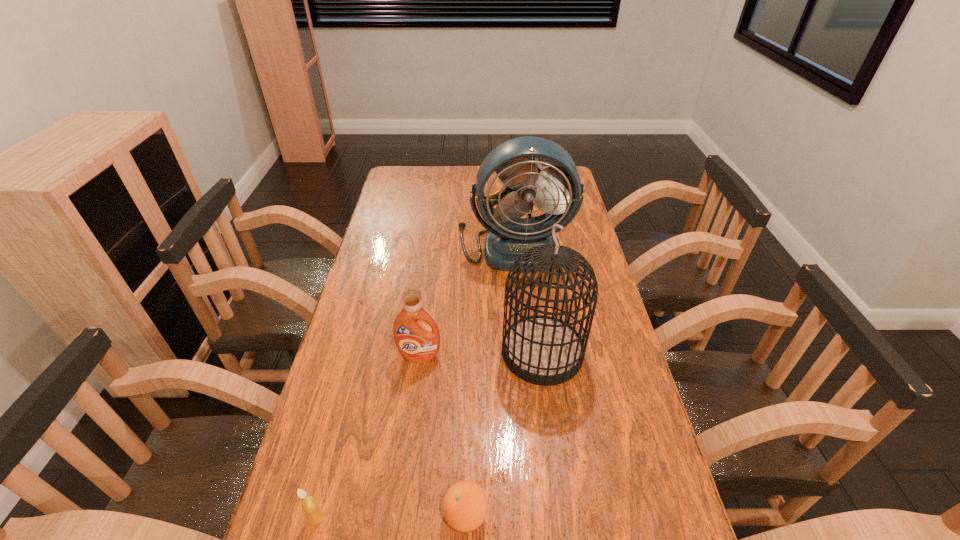
Where is `free region located 0.150m on the back of the candle`? free region located 0.150m on the back of the candle is located at coordinates (337, 442).

Locate an element on the screen. This screenshot has height=540, width=960. free space located on the left of the shortest object is located at coordinates (331, 515).

Where is `object present at the left edge`? object present at the left edge is located at coordinates (310, 506).

This screenshot has width=960, height=540. Find the location of `fan present at the right edge`. fan present at the right edge is located at coordinates (556, 190).

The image size is (960, 540). What are the coordinates of `birdcage at the right edge` in the screenshot? It's located at (543, 350).

I want to click on free spot at the far edge of the desktop, so click(492, 181).

At what (x,y) coordinates should I click in order to perform the action: click on free space at the left edge of the desktop. Please return your answer as a coordinate pair (x, y). This screenshot has width=960, height=540. Looking at the image, I should click on (352, 479).

I want to click on blank space at the right edge of the desktop, so click(627, 447).

I want to click on vacant space that's between the fourth tallest object and the shortest object, so click(x=392, y=516).

Image resolution: width=960 pixels, height=540 pixels. Identify the location of vacant point located between the farthest object and the fourth object from right to left. (467, 301).